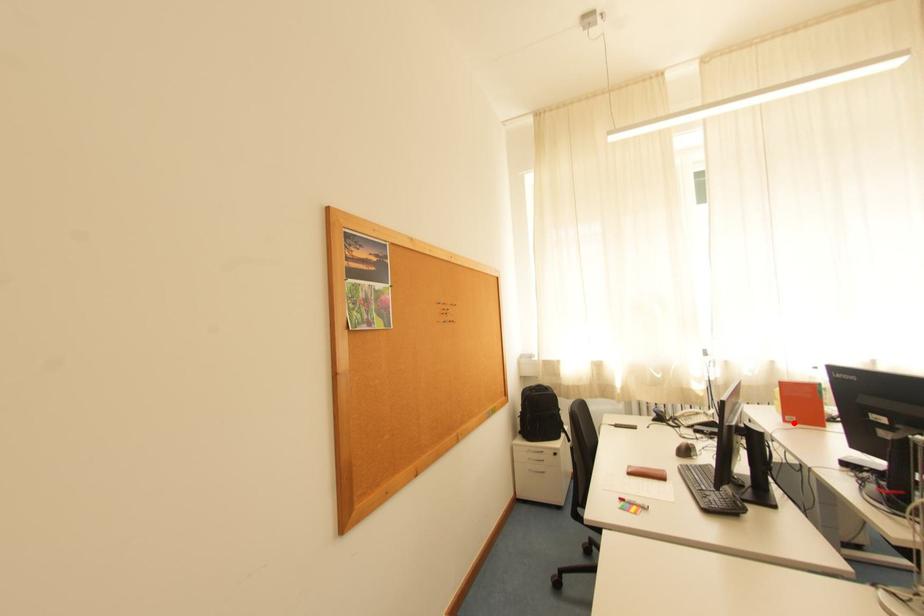
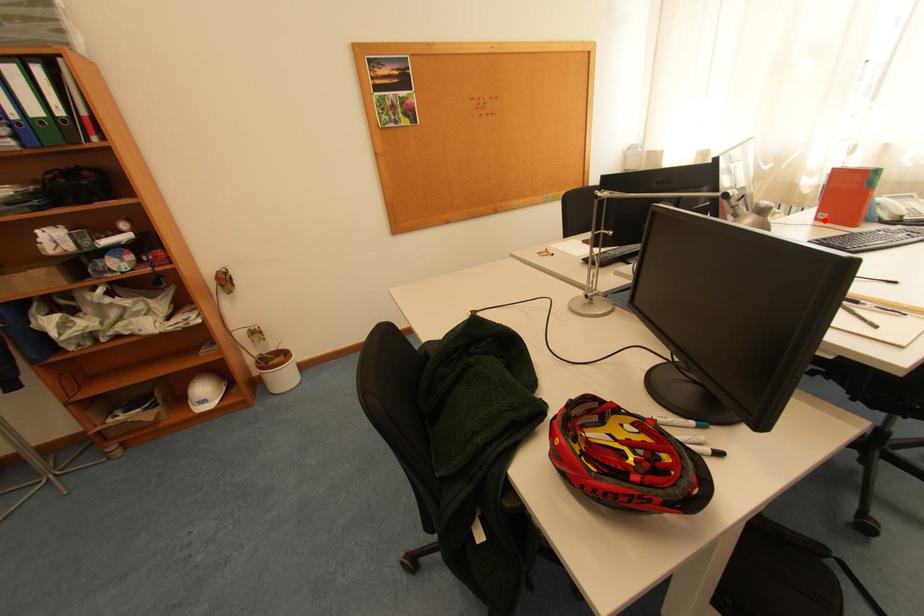
I am providing you with two images of the same scene from different viewpoints. A red point is marked on the first image and another point is marked on the second image. Is the marked point in image1 the same physical position as the marked point in image2?

Yes